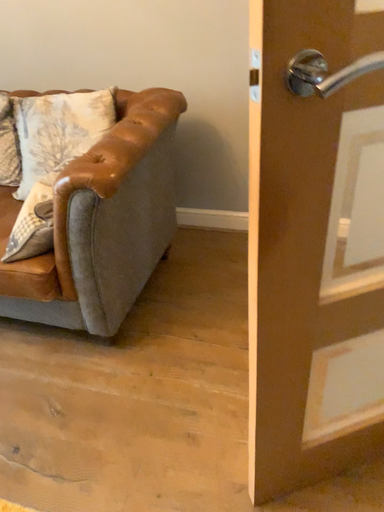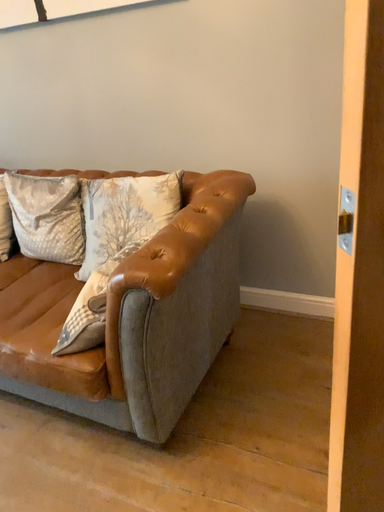
Question: Which way did the camera rotate in the video?

Choices:
 (A) rotated left
 (B) rotated right

Answer: (A)